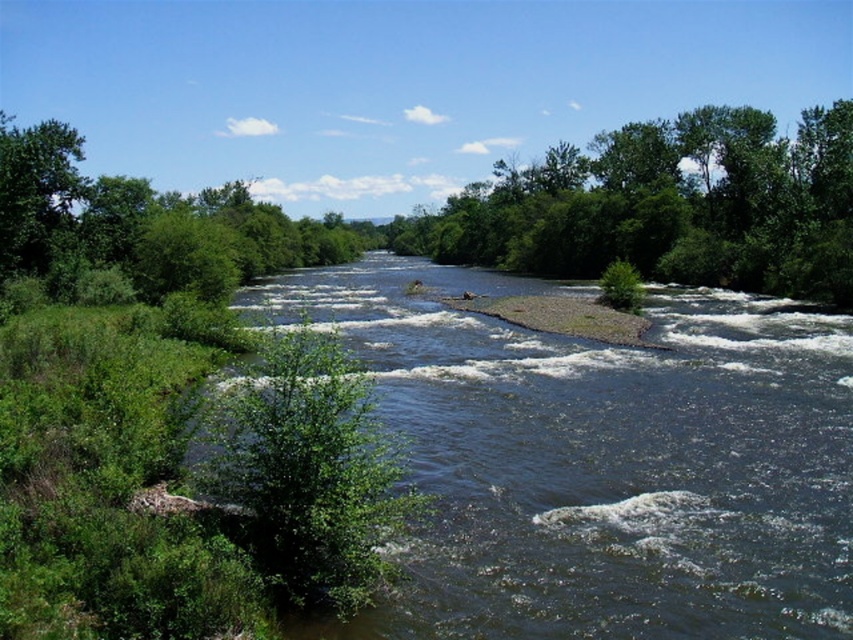
Question: Which object is positioned farthest from the green leafy tree at left?

Choices:
 (A) green leafy tree at center
 (B) dark blue water at center

Answer: (A)

Question: Estimate the real-world distances between objects in this image. Which object is farther from the green leafy tree at left?

Choices:
 (A) dark blue water at center
 (B) green leafy tree at center

Answer: (B)

Question: Which object is the closest to the dark blue water at center?

Choices:
 (A) green leafy tree at center
 (B) green leafy tree at left

Answer: (B)

Question: Is green leafy tree at center below green leafy tree at left?

Choices:
 (A) yes
 (B) no

Answer: (B)

Question: Can you confirm if dark blue water at center is wider than green leafy tree at center?

Choices:
 (A) yes
 (B) no

Answer: (B)

Question: Can you confirm if green leafy tree at center is bigger than green leafy tree at left?

Choices:
 (A) yes
 (B) no

Answer: (A)